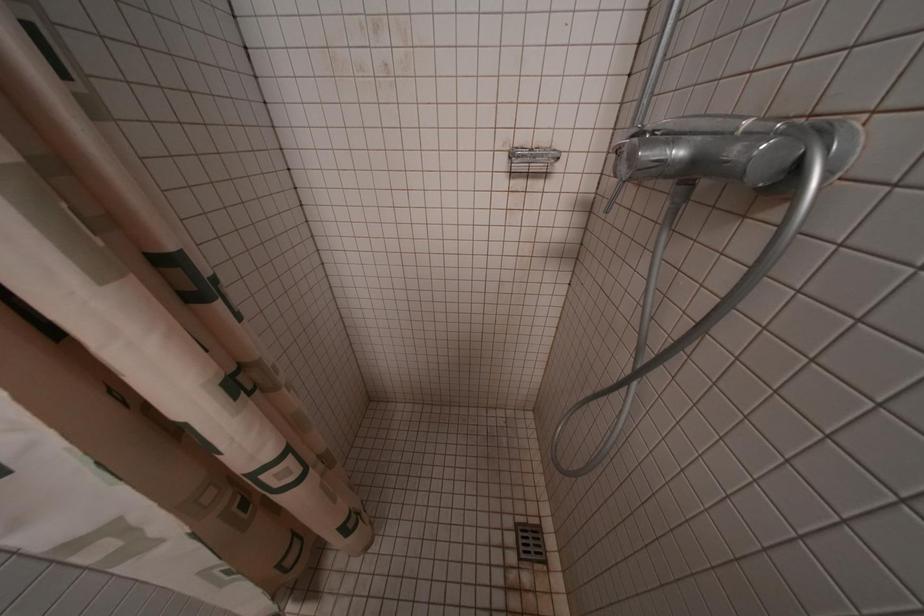
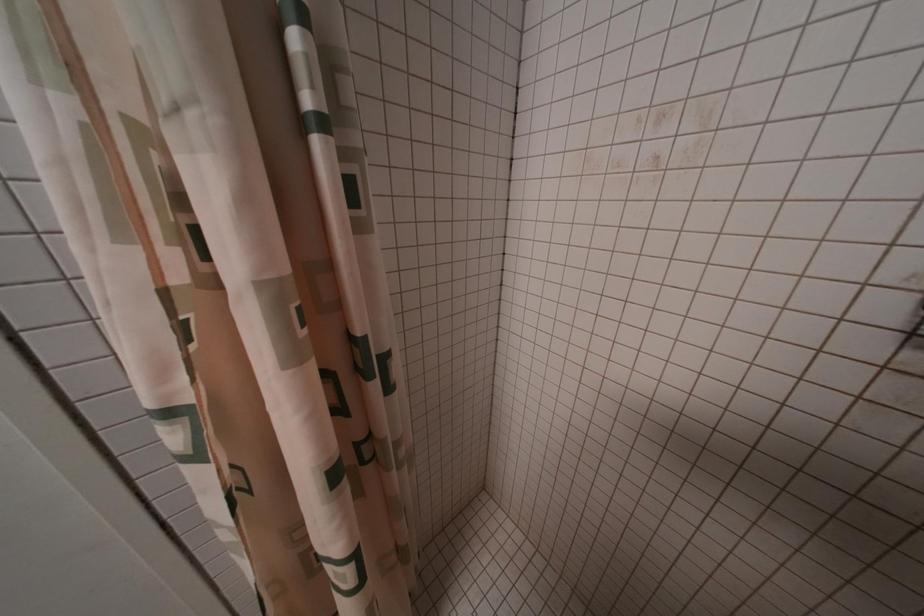
Question: How did the camera likely rotate?

Choices:
 (A) Left
 (B) Right
 (C) Up
 (D) Down

Answer: (A)